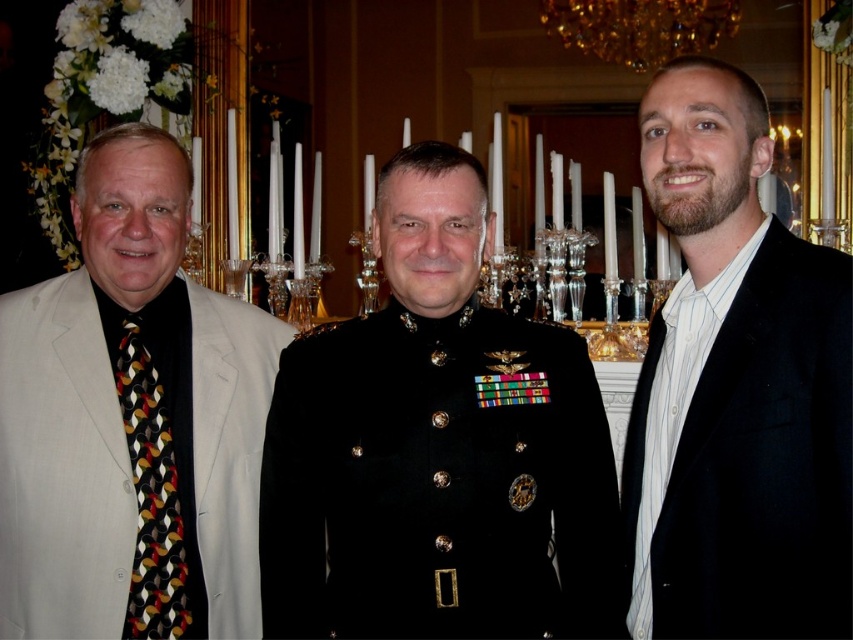
You are a photographer positioned at the front of the room. You need to take a photo of both the light beige suit at left and the black velvet suit at right. Which person should you focus on first to ensure both are in focus?

You should focus on the light beige suit at left first because it is closer to you than the black velvet suit at right, so focusing on it will help ensure both are in focus.

You are standing at the origin point of the coordinate system in the image. You want to move towards the light beige suit at left. Which direction should you move in terms of x and y coordinates?

The light beige suit at left is located at coordinate point 0.659 on the x axis and 0.155 on the y axis. Therefore, you should move towards increasing x and decreasing y coordinates.